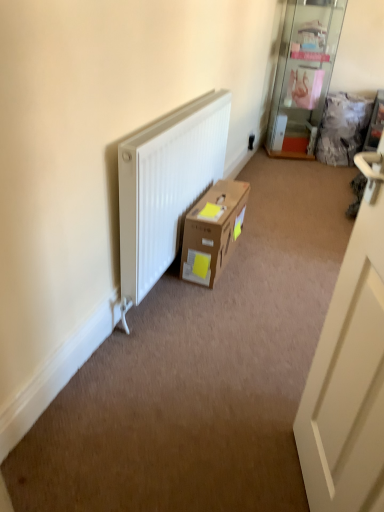
Where is `vacant area that is in front of brown cardboard box at center`? vacant area that is in front of brown cardboard box at center is located at coordinates (221, 298).